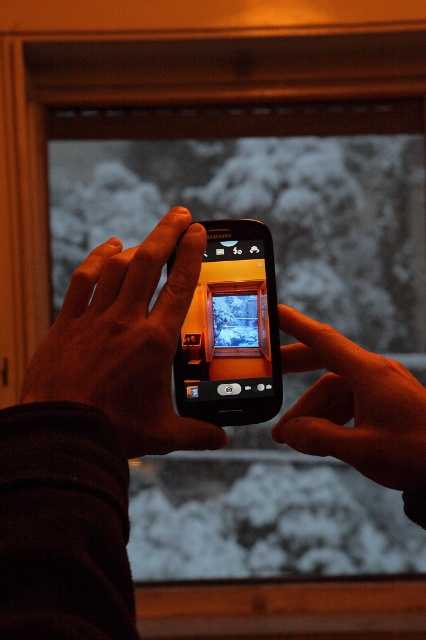
You are trying to decide which phone to use for taking a photo through the window. The black matte phone at center and the black glossy phone at center are both available. Which one has a larger screen width?

The black matte phone at center might be wider than the black glossy phone at center, so it could have a larger screen width.

You are a photographer trying to capture the snowy landscape through the window. The black matte phone at center is located at point (126, 339). Where should you position your camera to ensure the phone is centered in the frame?

The black matte phone at center is already located at point (126, 339), so positioning the camera directly at that point will center the phone in the frame.